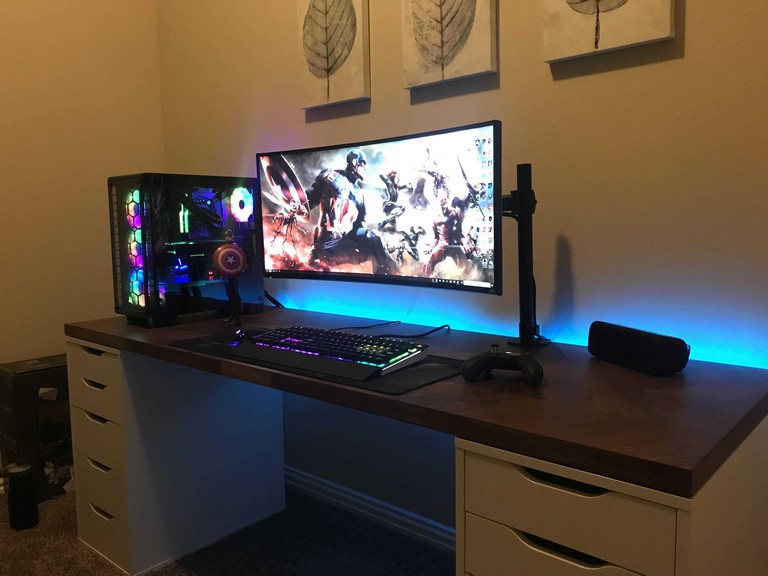
The image size is (768, 576). I want to click on the lower drawer on the left side, so click(x=108, y=541).